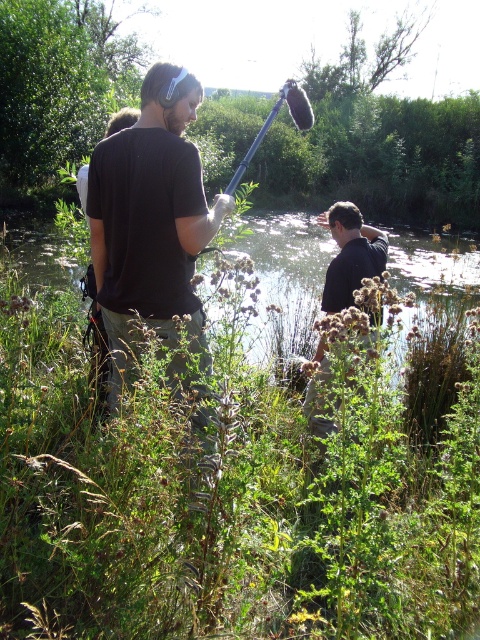
Can you confirm if black matte shirt at left is taller than black matte shirt at center?

Correct, black matte shirt at left is much taller as black matte shirt at center.

Which is more to the left, black matte shirt at left or black matte shirt at center?

Positioned to the left is black matte shirt at left.

I want to click on black matte shirt at left, so click(151, 218).

Where is `black matte shirt at left`? black matte shirt at left is located at coordinates (151, 218).

Can you confirm if clear water at center is shorter than black matte shirt at center?

No.

Is point (15, 227) positioned behind point (356, 259)?

Yes.

Locate an element on the screen. The height and width of the screenshot is (640, 480). clear water at center is located at coordinates (285, 282).

I want to click on clear water at center, so click(x=285, y=282).

Is point (175, 92) positioned before point (388, 250)?

Yes, point (175, 92) is in front of point (388, 250).

Is point (211, 221) more distant than point (282, 324)?

No.

Who is more forward, (144, 168) or (291, 268)?

Point (144, 168) is in front.

In order to click on black matte shirt at left in this screenshot , I will do `click(151, 218)`.